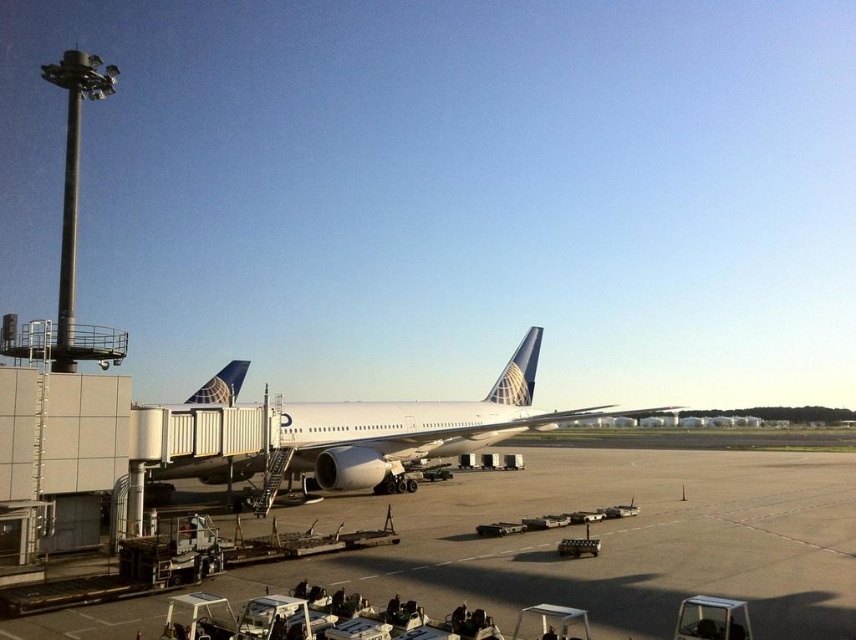
You are an airport staff member who needs to park a new vehicle that is 2 meters wide. You see the smooth concrete tarmac at center and the white matte airplane at center. Which area can accommodate the vehicle based on their widths?

The smooth concrete tarmac at center is narrower than the white matte airplane at center, so the vehicle cannot be parked on the tarmac since it is narrower than the vehicle. The airplane is wider, but parking the vehicle there is not appropriate as it is an airplane.